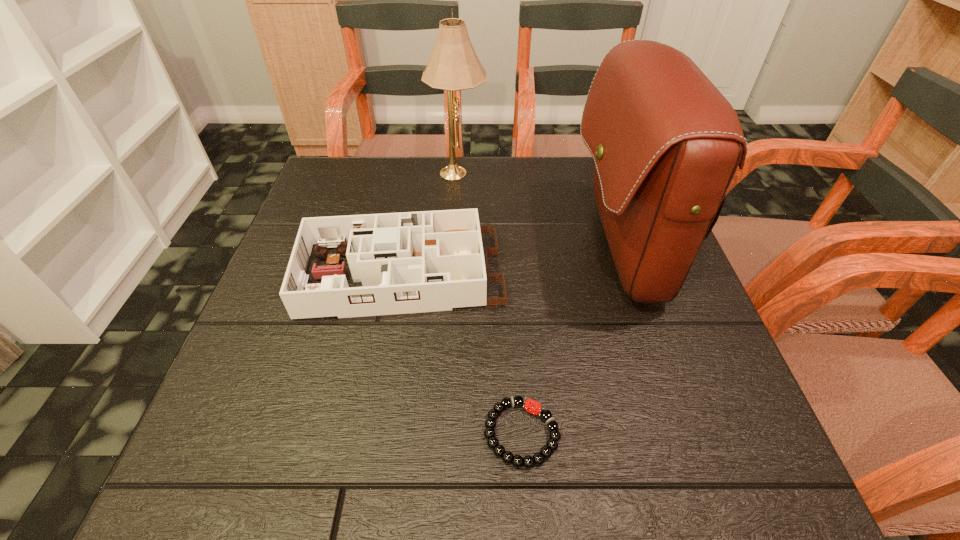
The image size is (960, 540). In order to click on vacant space at the far left corner of the desktop in this screenshot , I will do `click(311, 192)`.

Find the location of `free spot at the near left corner of the desktop`. free spot at the near left corner of the desktop is located at coordinates (181, 484).

Image resolution: width=960 pixels, height=540 pixels. I want to click on blank region between the shortest object and the rightmost object, so click(571, 342).

You are a GUI agent. You are given a task and a screenshot of the screen. Output one action in this format:
    pyautogui.click(x=<x>, y=<y>)
    Task: Click on the free spot between the lampshade and the rightmost object
    The width and height of the screenshot is (960, 540).
    Given the screenshot: What is the action you would take?
    pyautogui.click(x=540, y=211)

The height and width of the screenshot is (540, 960). Identify the location of vacant space in between the satchel and the third tallest object. (510, 262).

This screenshot has height=540, width=960. Identify the location of empty space that is in between the satchel and the shortest object. (571, 342).

Locate an element on the screen. empty space that is in between the shortest object and the rightmost object is located at coordinates (571, 342).

The width and height of the screenshot is (960, 540). What are the coordinates of `free spot between the satchel and the farthest object` in the screenshot? It's located at [540, 211].

Identify the location of empty space between the second shortest object and the nearest object. (460, 354).

At what (x,y) coordinates should I click in order to perform the action: click on free area in between the farthest object and the satchel. Please return your answer as a coordinate pair (x, y). Looking at the image, I should click on (540, 211).